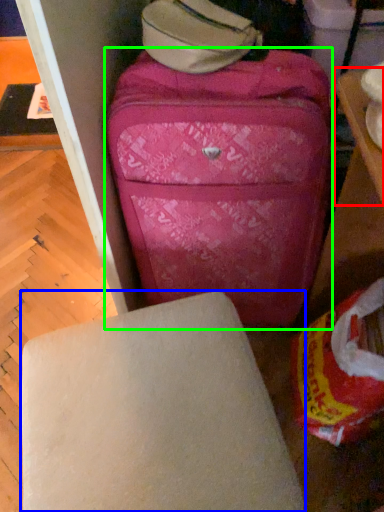
Question: Which object is positioned closest to table (highlighted by a red box)? Select from furniture (highlighted by a blue box) and suitcase (highlighted by a green box).

Choices:
 (A) furniture
 (B) suitcase

Answer: (B)